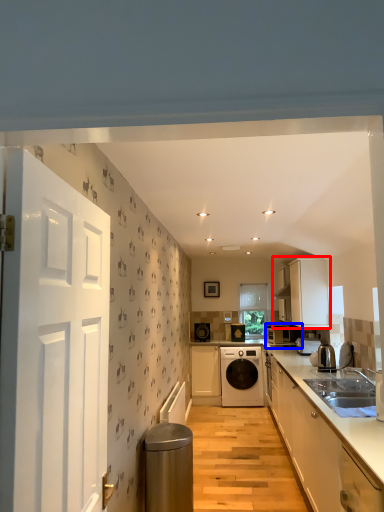
Question: Among these objects, which one is nearest to the camera, cabinetry (highlighted by a red box) or kitchen appliance (highlighted by a blue box)?

Choices:
 (A) cabinetry
 (B) kitchen appliance

Answer: (A)